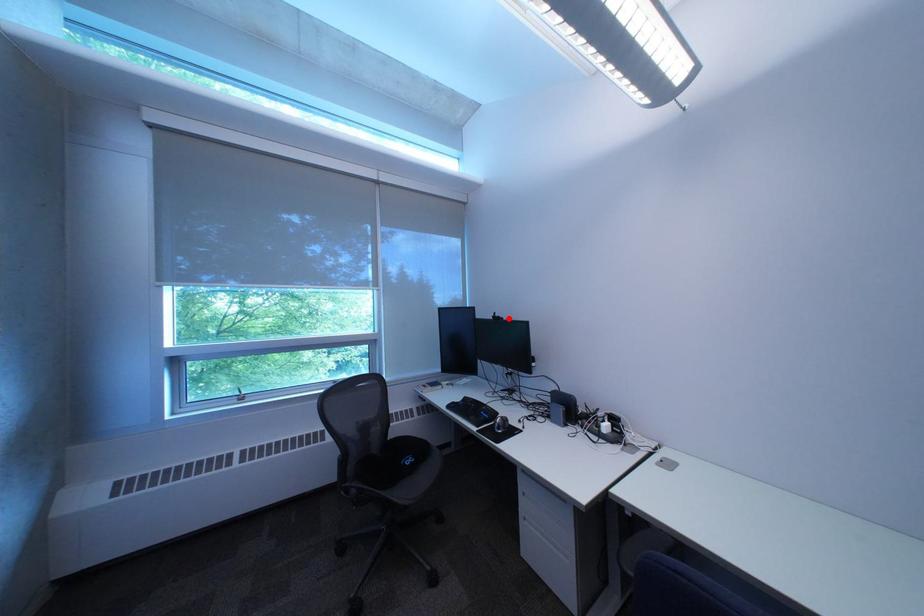
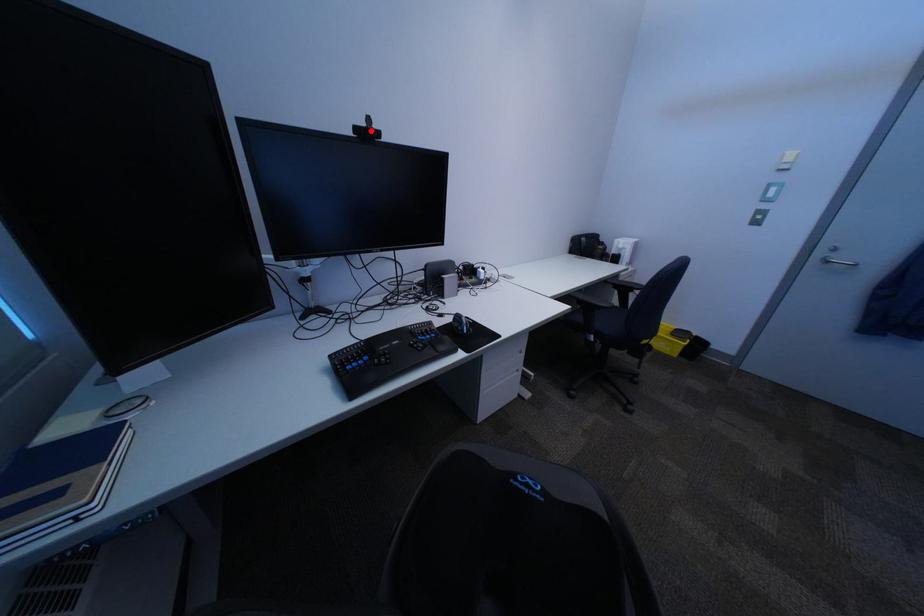
I am providing you with two images of the same scene from different viewpoints. A red point is marked on the first image and another point is marked on the second image. Is the red point in image1 aligned with the point shown in image2?

Yes